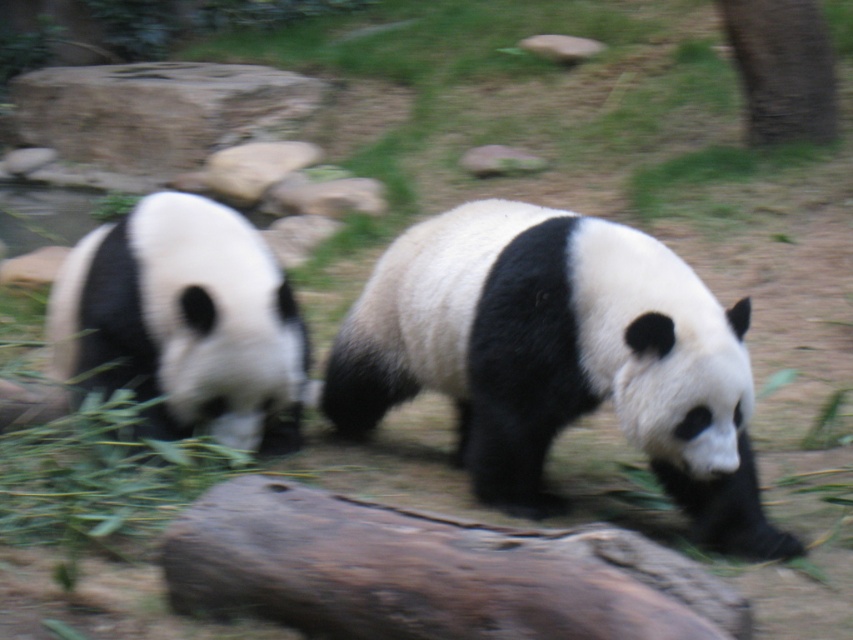
Question: Which object is farther from the camera taking this photo?

Choices:
 (A) brown rough tree trunk at upper right
 (B) black and white fur panda at left

Answer: (A)

Question: Among these objects, which one is farthest from the camera?

Choices:
 (A) brown rough tree trunk at upper right
 (B) black and white fur panda at center
 (C) black and white fur panda at left

Answer: (A)

Question: Is black and white fur panda at center positioned at the back of black and white fur panda at left?

Choices:
 (A) no
 (B) yes

Answer: (A)

Question: Does brown rough log at center appear over brown rough tree trunk at upper right?

Choices:
 (A) no
 (B) yes

Answer: (A)

Question: Which point is closer to the camera?

Choices:
 (A) black and white fur panda at left
 (B) brown rough log at center
 (C) black and white fur panda at center

Answer: (B)

Question: Does black and white fur panda at center lie in front of brown rough tree trunk at upper right?

Choices:
 (A) yes
 (B) no

Answer: (A)